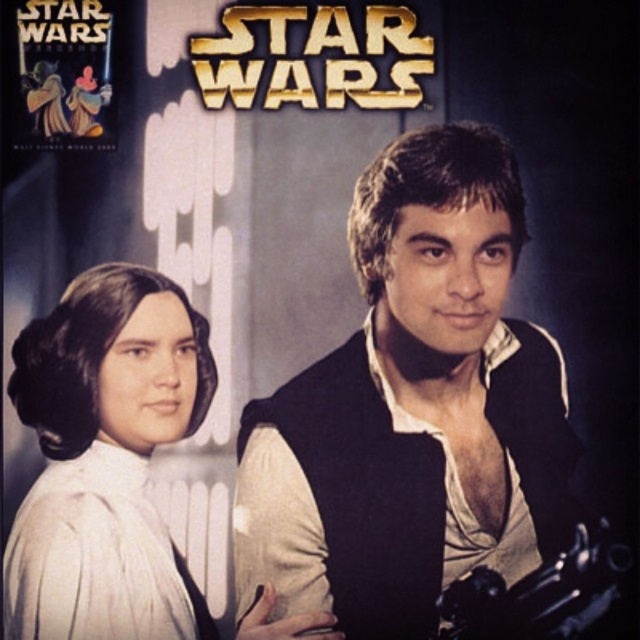
Who is shorter, matte black vest at center or white satin dress at left?

white satin dress at left is shorter.

Image resolution: width=640 pixels, height=640 pixels. I want to click on matte black vest at center, so click(x=413, y=408).

Who is more forward, (442, 564) or (77, 582)?

Point (77, 582) is more forward.

This screenshot has height=640, width=640. I want to click on matte black vest at center, so click(413, 408).

Who is shorter, matte black vest at center or polished metal gun at lower right?

polished metal gun at lower right

Can you confirm if matte black vest at center is positioned to the right of polished metal gun at lower right?

Incorrect, matte black vest at center is not on the right side of polished metal gun at lower right.

Between point (385, 508) and point (515, 612), which one is positioned behind?

Point (515, 612)

Find the location of a particular element. The height and width of the screenshot is (640, 640). matte black vest at center is located at coordinates (413, 408).

This screenshot has width=640, height=640. In order to click on white satin dress at left in this screenshot , I will do `click(99, 472)`.

Is point (13, 605) farther from camera compared to point (612, 556)?

No.

This screenshot has width=640, height=640. What do you see at coordinates (99, 472) in the screenshot?
I see `white satin dress at left` at bounding box center [99, 472].

The image size is (640, 640). What are the coordinates of `white satin dress at left` in the screenshot? It's located at (99, 472).